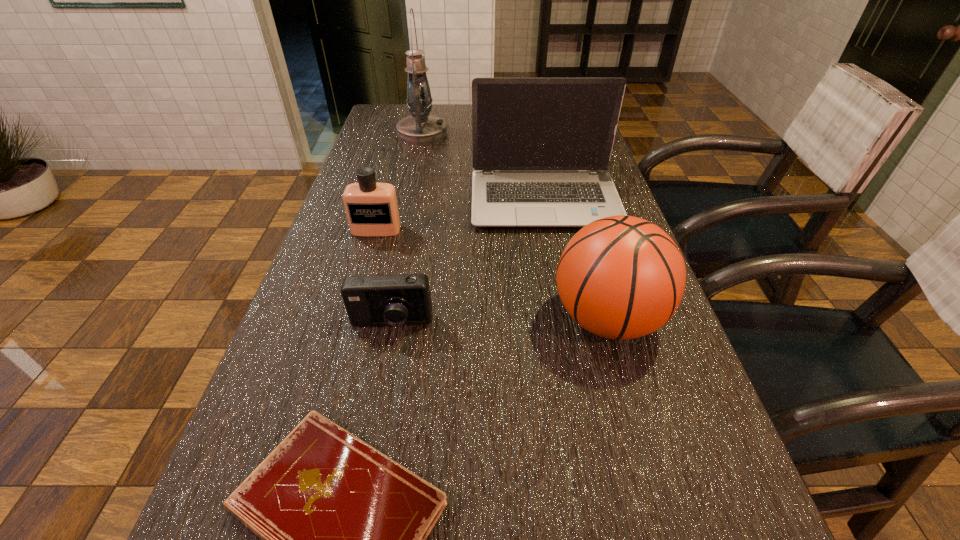
Image resolution: width=960 pixels, height=540 pixels. What are the coordinates of `the farthest object` in the screenshot? It's located at point(421,128).

Locate an element on the screen. The height and width of the screenshot is (540, 960). oil lamp is located at coordinates (421, 128).

Locate an element on the screen. This screenshot has width=960, height=540. laptop computer is located at coordinates tap(541, 147).

The width and height of the screenshot is (960, 540). I want to click on basketball, so click(x=621, y=277).

Identify the location of the fourth tallest object. The width and height of the screenshot is (960, 540). (372, 210).

The width and height of the screenshot is (960, 540). I want to click on the fifth tallest object, so click(380, 300).

Locate an element on the screen. This screenshot has height=540, width=960. vacant space situated 0.060m on the front of the oil lamp is located at coordinates (418, 154).

Identify the location of free space located 0.300m on the screen of the laptop computer. The height and width of the screenshot is (540, 960). (567, 324).

The width and height of the screenshot is (960, 540). Find the location of `vacant space located 0.360m on the back of the fourth shortest object`. vacant space located 0.360m on the back of the fourth shortest object is located at coordinates (571, 192).

The image size is (960, 540). In order to click on blank space located on the front label of the fourth tallest object in this screenshot , I will do `click(349, 323)`.